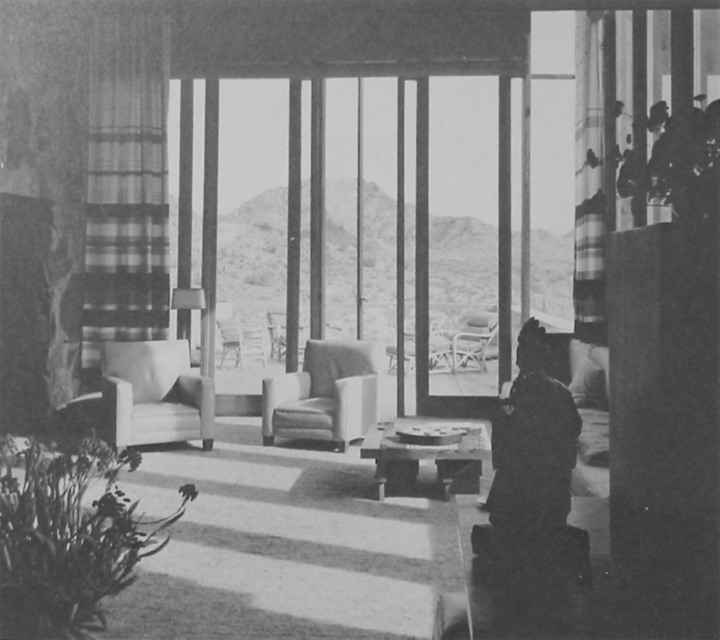
Between matte beige armchair at center and metallic silver chair at center, which one has more height?

matte beige armchair at center

What do you see at coordinates (156, 394) in the screenshot? Image resolution: width=720 pixels, height=640 pixels. I see `matte beige armchair at center` at bounding box center [156, 394].

The width and height of the screenshot is (720, 640). In order to click on matte beige armchair at center in this screenshot , I will do `click(156, 394)`.

Is matte beige armchair at center behind smooth leather chair at center?

No.

Who is more distant from viewer, (207, 388) or (234, 353)?

The point (234, 353) is more distant.

I want to click on matte beige armchair at center, so click(x=156, y=394).

Can you confirm if smooth leather armchair at center is positioned above smooth leather chair at center?

Incorrect, smooth leather armchair at center is not positioned above smooth leather chair at center.

Based on the photo, which is below, smooth leather armchair at center or smooth leather chair at center?

smooth leather armchair at center

Locate an element on the screen. smooth leather armchair at center is located at coordinates pos(324,396).

Where is `smooth leather armchair at center`? The image size is (720, 640). smooth leather armchair at center is located at coordinates (324, 396).